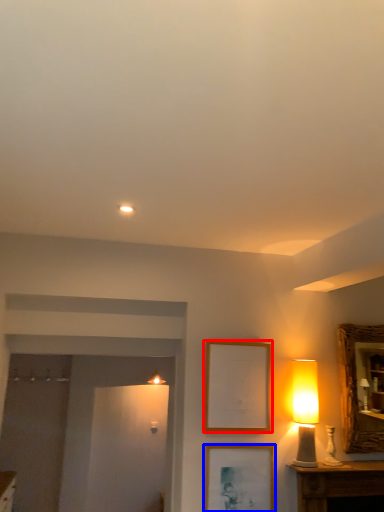
Question: Which object is further to the camera taking this photo, picture frame (highlighted by a red box) or picture frame (highlighted by a blue box)?

Choices:
 (A) picture frame
 (B) picture frame

Answer: (A)